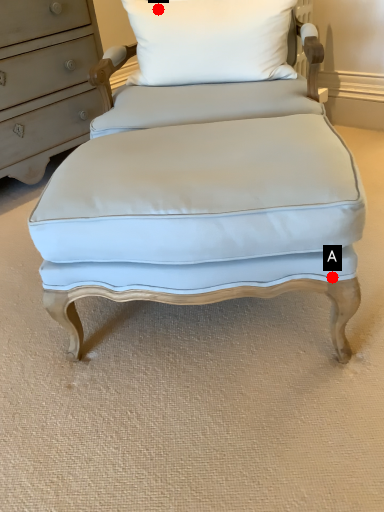
Question: Two points are circled on the image, labeled by A and B beside each circle. Among these points, which one is farthest from the camera?

Choices:
 (A) A is further
 (B) B is further

Answer: (B)